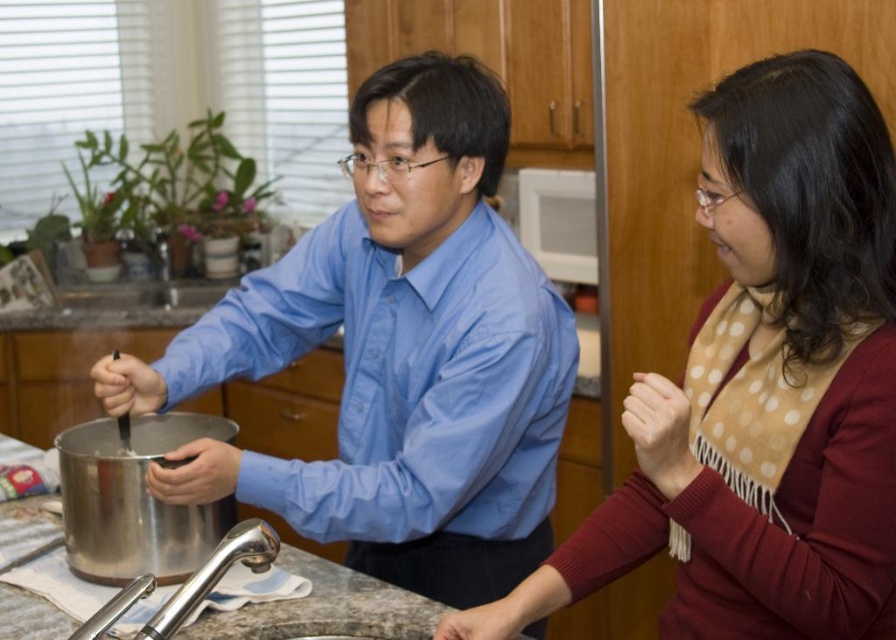
Is matte brown scarf at right below matte blue shirt at center?

Correct, matte brown scarf at right is located below matte blue shirt at center.

Which of these two, matte brown scarf at right or matte blue shirt at center, stands shorter?

matte brown scarf at right

Between point (832, 212) and point (360, 342), which one is positioned behind?

The point (360, 342) is behind.

Find the location of `matte brown scarf at right`. matte brown scarf at right is located at coordinates (763, 387).